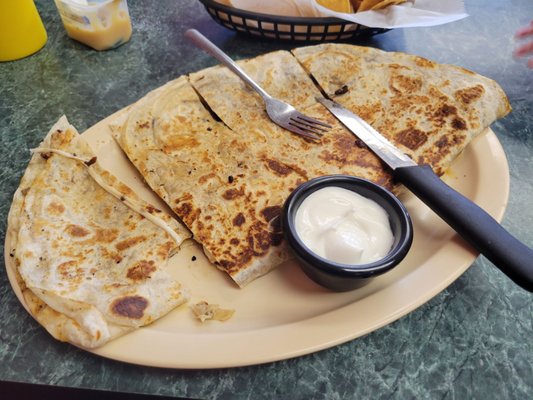
Image resolution: width=533 pixels, height=400 pixels. In order to click on black cup in this screenshot , I will do `click(309, 258)`.